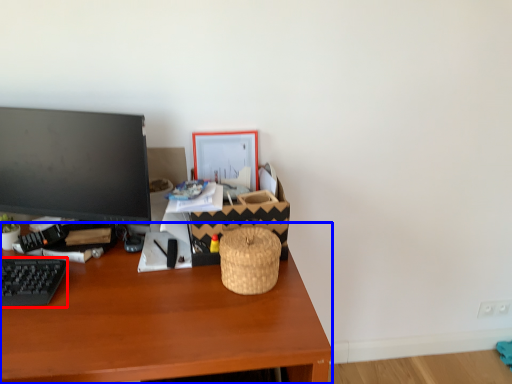
Question: Which object appears closest to the camera in this image, computer keyboard (highlighted by a red box) or desk (highlighted by a blue box)?

Choices:
 (A) computer keyboard
 (B) desk

Answer: (B)